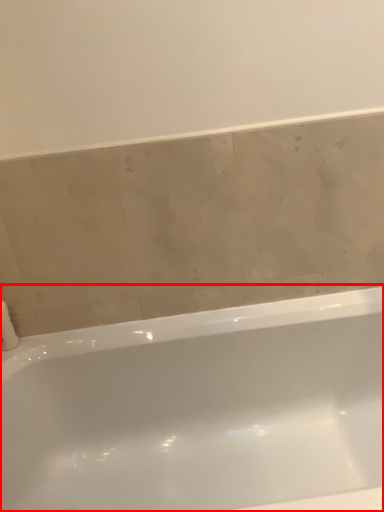
Question: From the image's perspective, where is bathtub (annotated by the red box) located in relation to toilet paper in the image?

Choices:
 (A) below
 (B) above

Answer: (A)